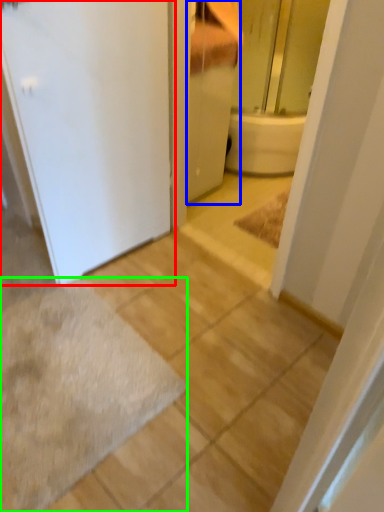
Question: Estimate the real-world distances between objects in this image. Which object is farther from door (highlighted by a red box), bathroom cabinet (highlighted by a blue box) or bath mat (highlighted by a green box)?

Choices:
 (A) bathroom cabinet
 (B) bath mat

Answer: (B)